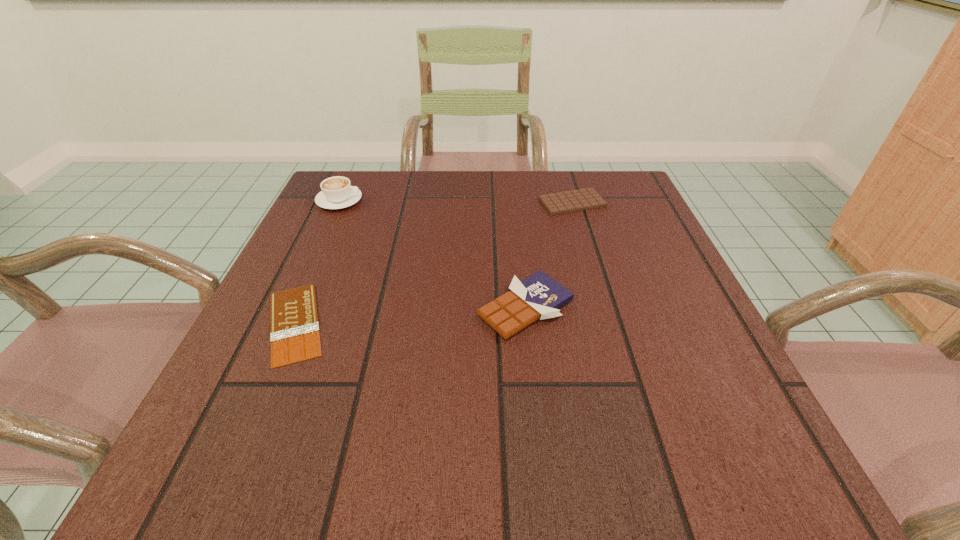
Find the location of a particular element. cappuccino present at the far edge is located at coordinates (337, 192).

Locate an element on the screen. This screenshot has height=540, width=960. chocolate bar at the far edge is located at coordinates (582, 199).

Image resolution: width=960 pixels, height=540 pixels. Identify the location of cappuccino positioned at the left edge. (337, 192).

This screenshot has width=960, height=540. I want to click on chocolate bar positioned at the left edge, so click(x=294, y=327).

You are a GUI agent. You are given a task and a screenshot of the screen. Output one action in this format:
    pyautogui.click(x=<x>, y=<y>)
    Task: Click on the object that is at the right edge
    Image resolution: width=960 pixels, height=540 pixels.
    Given the screenshot: What is the action you would take?
    pyautogui.click(x=582, y=199)

This screenshot has width=960, height=540. I want to click on object positioned at the far left corner, so click(337, 192).

Find the location of `object located at the far right corner`. object located at the far right corner is located at coordinates (582, 199).

Locate an element on the screen. The image size is (960, 540). free region at the far edge of the desktop is located at coordinates (433, 173).

The image size is (960, 540). In the image, there is a desktop. Identify the location of vacant space at the near edge. (616, 451).

The image size is (960, 540). In the image, there is a desktop. What are the coordinates of `vacant space at the left edge` in the screenshot? It's located at (217, 418).